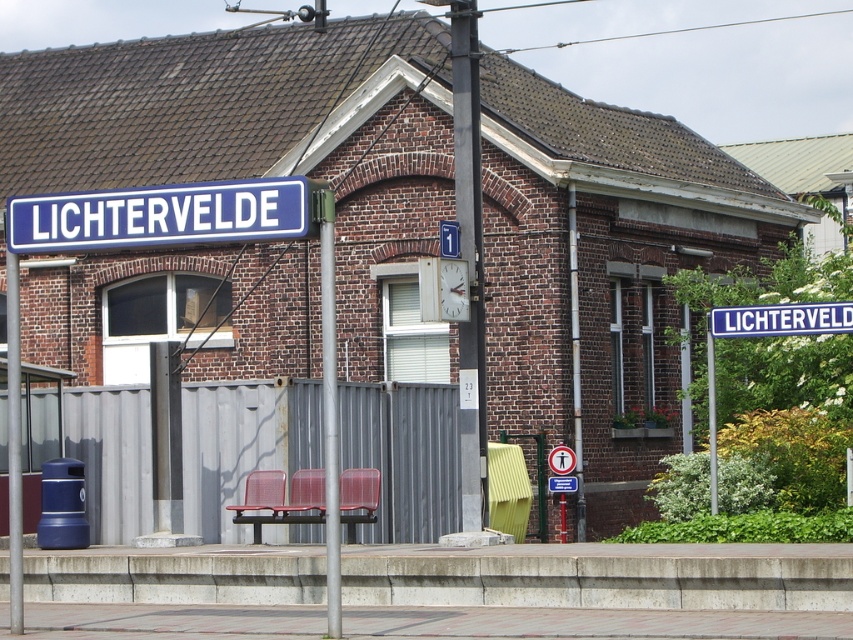
Does metallic pole at center appear on the right side of blue metallic signboard at upper center?

Incorrect, metallic pole at center is not on the right side of blue metallic signboard at upper center.

Can you confirm if metallic pole at center is smaller than blue metallic signboard at upper center?

Yes.

What do you see at coordinates (468, 256) in the screenshot? The image size is (853, 640). I see `metallic pole at center` at bounding box center [468, 256].

Where is `metallic pole at center`? The height and width of the screenshot is (640, 853). metallic pole at center is located at coordinates (468, 256).

Does point (473, 212) come behind point (328, 308)?

Yes.

Is metallic pole at center positioned behind silver metallic pole at center?

Yes, it is.

Which is in front, point (459, 141) or point (339, 557)?

Point (339, 557) is in front.

The height and width of the screenshot is (640, 853). What are the coordinates of `metallic pole at center` in the screenshot? It's located at (468, 256).

Image resolution: width=853 pixels, height=640 pixels. Find the location of `blue metallic signboard at upper left`. blue metallic signboard at upper left is located at coordinates (161, 216).

Describe the element at coordinates (161, 216) in the screenshot. I see `blue metallic signboard at upper left` at that location.

Which is in front, point (128, 205) or point (325, 284)?

Point (325, 284) is in front.

At what (x,y) coordinates should I click in order to perform the action: click on blue metallic signboard at upper left. Please return your answer as a coordinate pair (x, y). Looking at the image, I should click on (161, 216).